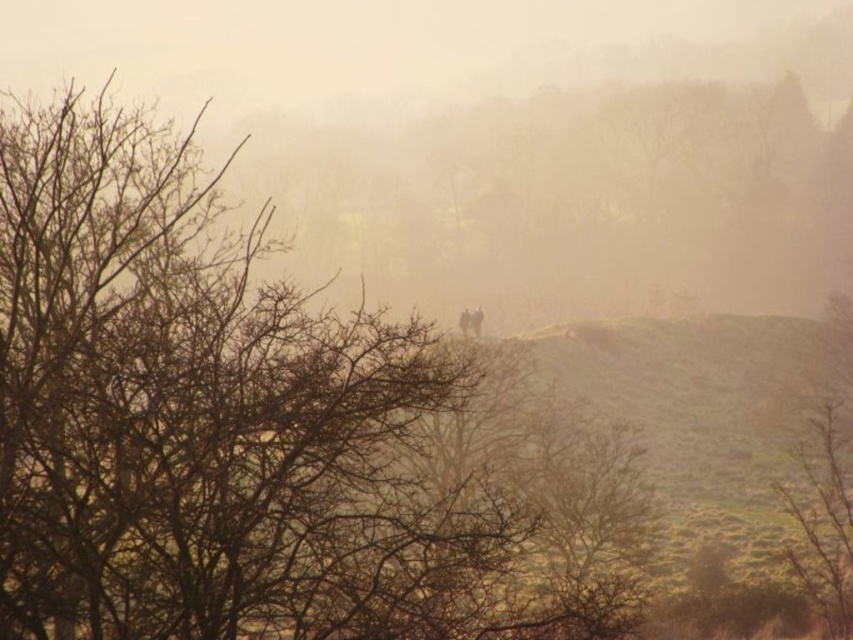
Does foggy atmosphere at center lie in front of brown matte tree at right?

No, it is behind brown matte tree at right.

Who is lower down, foggy atmosphere at center or brown matte tree at right?

Positioned lower is brown matte tree at right.

Where is `foggy atmosphere at center`? The height and width of the screenshot is (640, 853). foggy atmosphere at center is located at coordinates (503, 140).

Is brown leafless tree at center taller than foggy atmosphere at center?

Incorrect, brown leafless tree at center's height is not larger of foggy atmosphere at center's.

Is the position of brown leafless tree at center more distant than that of foggy atmosphere at center?

No, brown leafless tree at center is closer to the viewer.

Between point (1, 166) and point (368, 269), which one is positioned in front?

Point (1, 166)

This screenshot has width=853, height=640. What are the coordinates of `brown leafless tree at center` in the screenshot? It's located at (265, 432).

Does brown leafless tree at center appear over brown matte tree at right?

Indeed, brown leafless tree at center is positioned over brown matte tree at right.

Describe the element at coordinates (265, 432) in the screenshot. I see `brown leafless tree at center` at that location.

Locate an element on the screen. brown leafless tree at center is located at coordinates point(265,432).